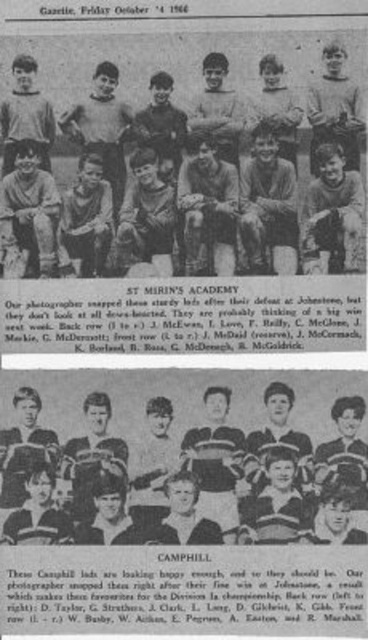
You are a photographer reviewing the image of the St Mirin Academy football team. You notice two points marked in the photo. Which point is closer to you, point at coordinate (x=121, y=193) or point at coordinate (x=289, y=394)?

Point at coordinate (x=121, y=193) is closer to you than point at coordinate (x=289, y=394).

Looking at the St Mirin Academy football team photo, you notice the matte gray uniforms at center and the striped jersey baseball team at lower center. Which group of players occupies more horizontal space in the image?

The matte gray uniforms at center occupy more horizontal space than the striped jersey baseball team at lower center because their width surpasses the latter.